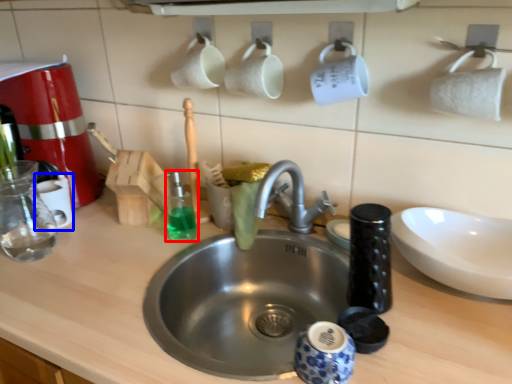
Question: Which object appears farthest to the camera in this image, cleaning product (highlighted by a red box) or mug (highlighted by a blue box)?

Choices:
 (A) cleaning product
 (B) mug

Answer: (B)